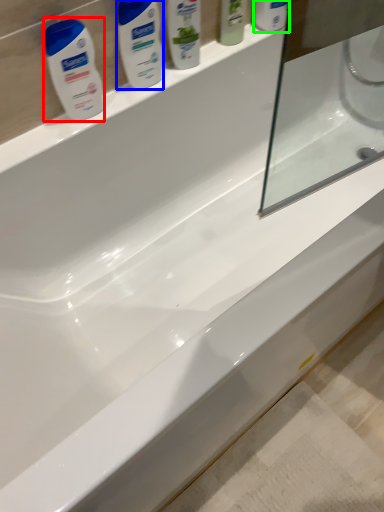
Question: Estimate the real-world distances between objects in this image. Which object is closer to cleaning product (highlighted by a red box), personal care (highlighted by a blue box) or mouthwash (highlighted by a green box)?

Choices:
 (A) personal care
 (B) mouthwash

Answer: (A)